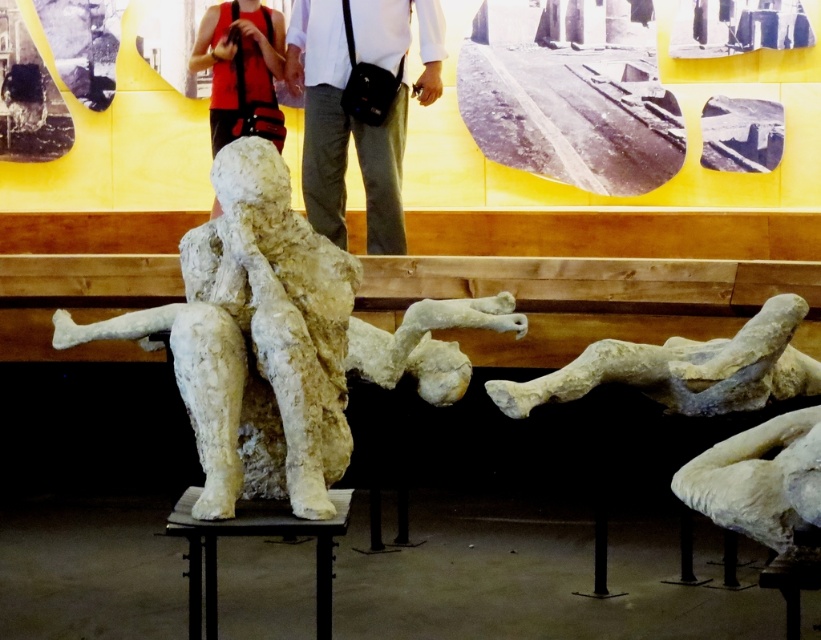
Question: Is light gray cotton pants at center thinner than white stone figure at lower right?

Choices:
 (A) no
 (B) yes

Answer: (B)

Question: Does light gray cotton pants at center have a lesser width compared to white stone figure at lower right?

Choices:
 (A) no
 (B) yes

Answer: (B)

Question: Is light gray cotton pants at center behind white stone figure at lower right?

Choices:
 (A) no
 (B) yes

Answer: (B)

Question: Which is farther from the matte red vest at upper center?

Choices:
 (A) white stone figure at center
 (B) white stone figure at lower right
 (C) light gray cotton pants at center

Answer: (A)

Question: Estimate the real-world distances between objects in this image. Which object is closer to the white stone figure at lower right?

Choices:
 (A) white stone figure at center
 (B) matte red vest at upper center
 (C) light gray cotton pants at center

Answer: (A)

Question: Based on their relative distances, which object is nearer to the light gray cotton pants at center?

Choices:
 (A) white stone figure at lower right
 (B) matte red vest at upper center

Answer: (B)